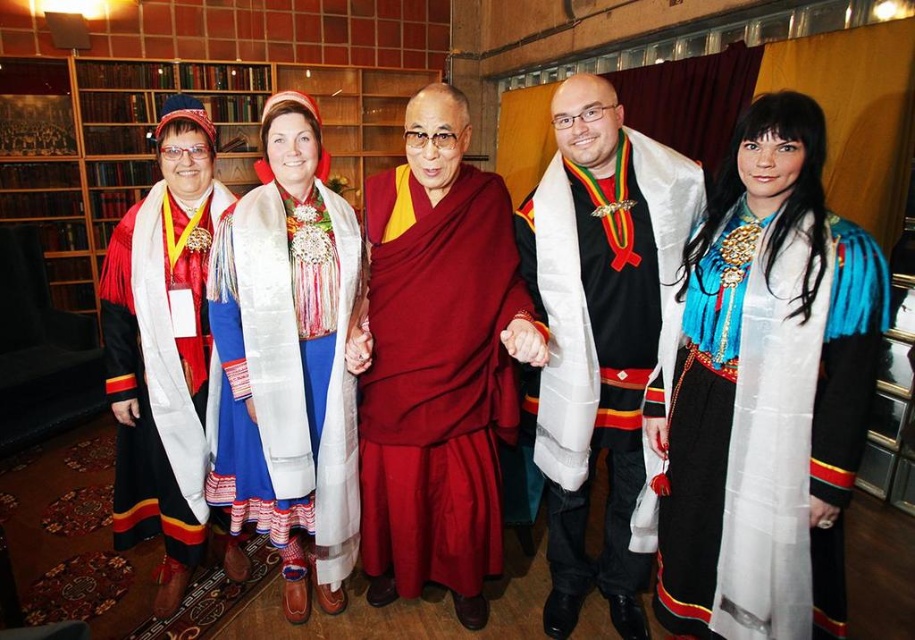
Which of these two, black velvet robe at center or silky white scarf at center, stands taller?

With more height is black velvet robe at center.

Is point (605, 148) closer to camera compared to point (348, 502)?

Yes, point (605, 148) is in front of point (348, 502).

This screenshot has height=640, width=915. I want to click on black velvet robe at center, so click(599, 332).

Looking at this image, is blue silk dress at center behind black velvet robe at center?

No, blue silk dress at center is closer to the viewer.

Who is more forward, (790,132) or (640,580)?

Point (790,132) is more forward.

What do you see at coordinates (766, 392) in the screenshot? I see `blue silk dress at center` at bounding box center [766, 392].

Where is `blue silk dress at center`? This screenshot has height=640, width=915. blue silk dress at center is located at coordinates (766, 392).

From the picture: Which is more to the left, black velvet robe at center or matte black robe at left?

Positioned to the left is matte black robe at left.

At what (x,y) coordinates should I click in order to perform the action: click on black velvet robe at center. Please return your answer as a coordinate pair (x, y). The height and width of the screenshot is (640, 915). Looking at the image, I should click on (599, 332).